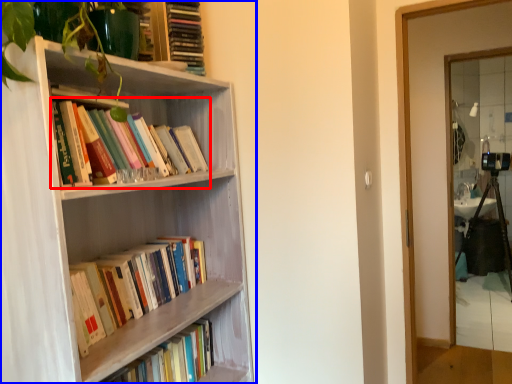
Question: Which object is further to the camera taking this photo, book (highlighted by a red box) or bookcase (highlighted by a blue box)?

Choices:
 (A) book
 (B) bookcase

Answer: (A)